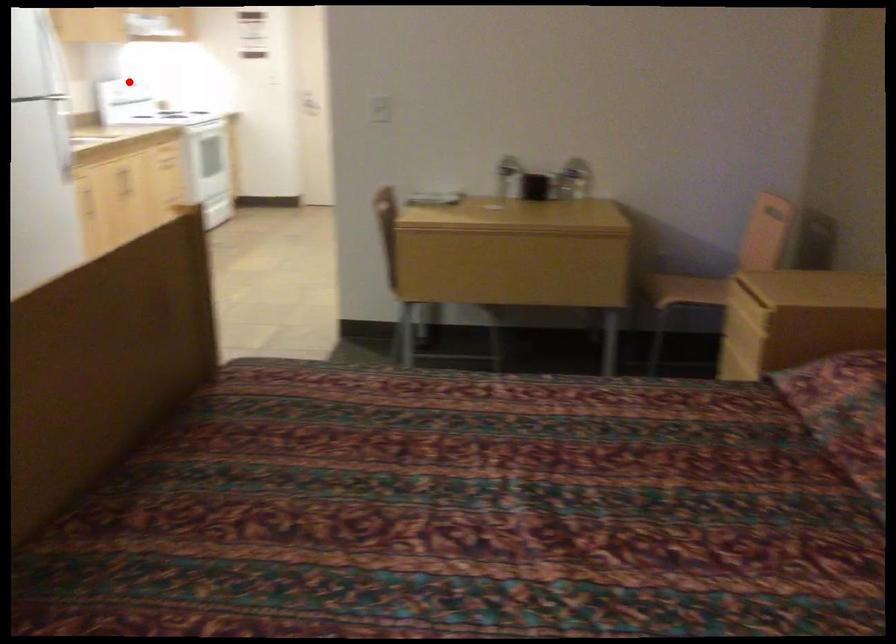
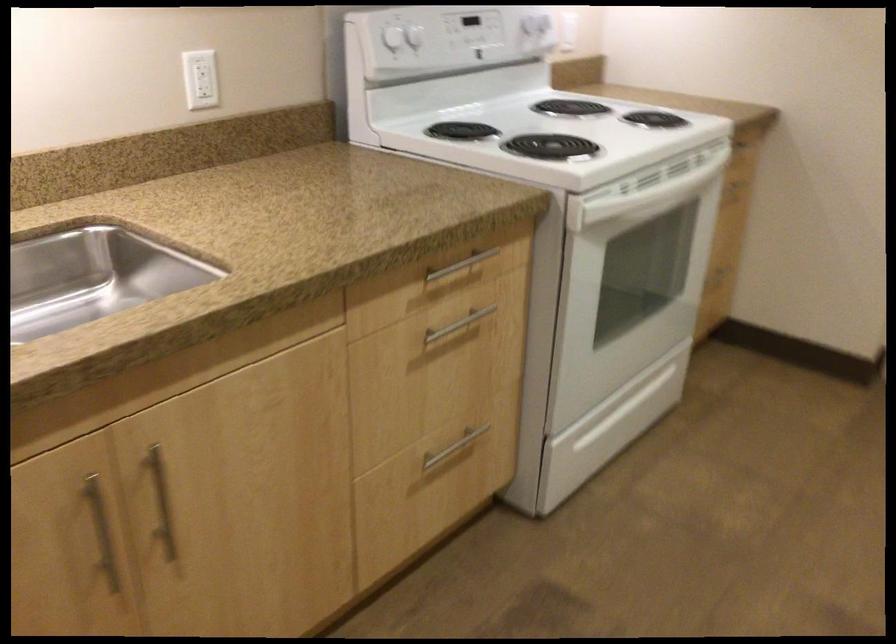
The point at the highlighted location is marked in the first image. Where is the corresponding point in the second image?

(414, 37)